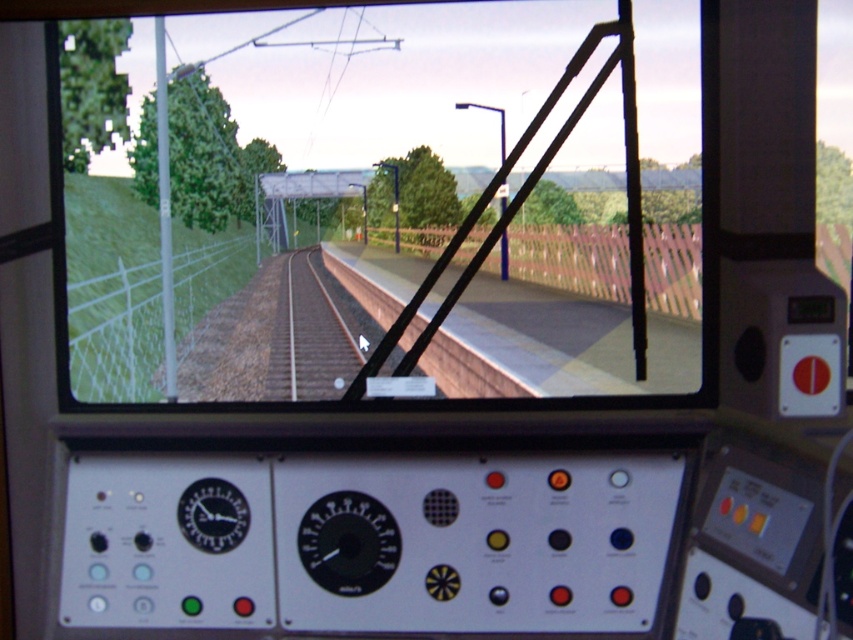
Question: Which is farther from the black plastic gauge at center?

Choices:
 (A) black plastic clock at center
 (B) clear glass train window at center
 (C) brown gravel train track at center

Answer: (C)

Question: Can you confirm if clear glass train window at center is positioned below brown gravel train track at center?

Choices:
 (A) no
 (B) yes

Answer: (A)

Question: Is clear glass train window at center to the right of black plastic clock at center from the viewer's perspective?

Choices:
 (A) yes
 (B) no

Answer: (B)

Question: Considering the relative positions of clear glass train window at center and black plastic clock at center in the image provided, where is clear glass train window at center located with respect to black plastic clock at center?

Choices:
 (A) right
 (B) left

Answer: (B)

Question: Which object appears closest to the camera in this image?

Choices:
 (A) black plastic gauge at center
 (B) clear glass train window at center
 (C) brown gravel train track at center
 (D) black plastic clock at center

Answer: (A)

Question: Which object is farther from the camera taking this photo?

Choices:
 (A) black plastic gauge at center
 (B) black plastic clock at center
 (C) clear glass train window at center
 (D) brown gravel train track at center

Answer: (D)